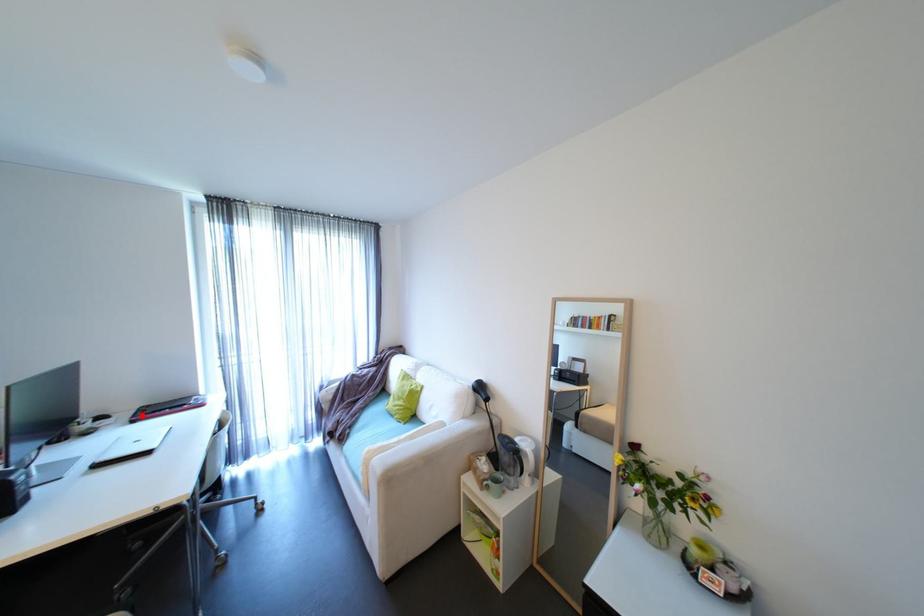
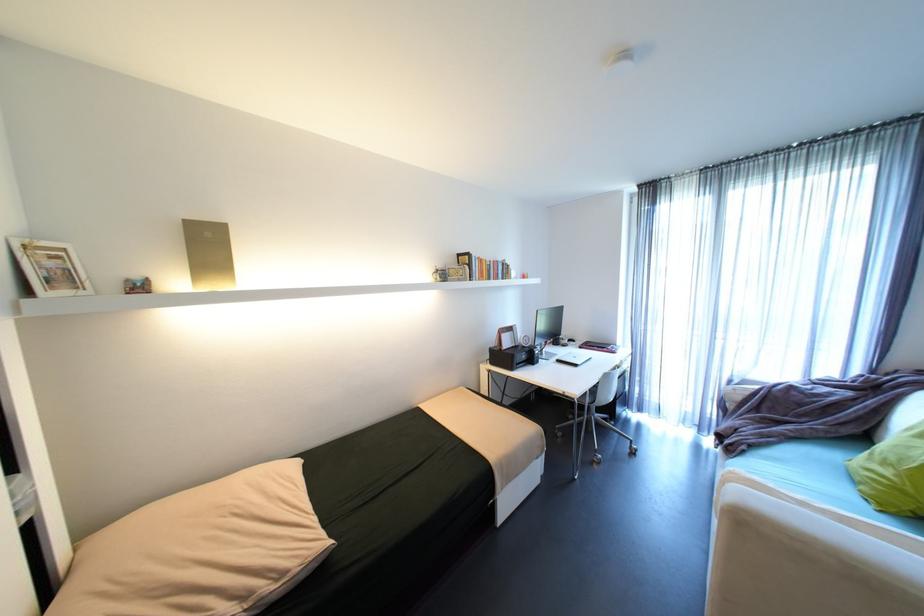
Question: I am providing you with two images of the same scene from different viewpoints. A red point is marked on the first image. Can you still see the location of the red point in image 2?

Choices:
 (A) Yes
 (B) No

Answer: (A)